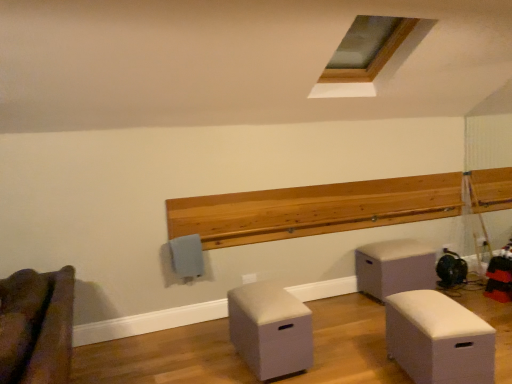
Question: Could clear glass window at upper center be considered to be inside beige fabric ottoman at center, which ranks as the third furniture in right-to-left order?

Choices:
 (A) no
 (B) yes

Answer: (A)

Question: Does beige fabric ottoman at center, which is the 2th furniture from left to right, appear on the right side of clear glass window at upper center?

Choices:
 (A) no
 (B) yes

Answer: (A)

Question: Is beige fabric ottoman at center, which ranks as the third furniture in right-to-left order, located outside clear glass window at upper center?

Choices:
 (A) yes
 (B) no

Answer: (A)

Question: Can you confirm if beige fabric ottoman at center, which is the 2th furniture from left to right, is shorter than clear glass window at upper center?

Choices:
 (A) yes
 (B) no

Answer: (A)

Question: Considering the relative sizes of beige fabric ottoman at center, which ranks as the third furniture in right-to-left order, and clear glass window at upper center in the image provided, is beige fabric ottoman at center, which ranks as the third furniture in right-to-left order, smaller than clear glass window at upper center?

Choices:
 (A) no
 (B) yes

Answer: (B)

Question: Does beige fabric ottoman at center, which ranks as the third furniture in right-to-left order, appear on the left side of clear glass window at upper center?

Choices:
 (A) yes
 (B) no

Answer: (A)

Question: Is wooden ledge at upper center positioned beyond the bounds of beige fabric ottoman at center, which ranks as the third furniture in right-to-left order?

Choices:
 (A) yes
 (B) no

Answer: (A)

Question: Is wooden ledge at upper center at the left side of beige fabric ottoman at center, which ranks as the third furniture in right-to-left order?

Choices:
 (A) yes
 (B) no

Answer: (B)

Question: Is wooden ledge at upper center to the right of beige fabric ottoman at center, which ranks as the third furniture in right-to-left order, from the viewer's perspective?

Choices:
 (A) no
 (B) yes

Answer: (B)

Question: Is wooden ledge at upper center taller than beige fabric ottoman at center, which ranks as the third furniture in right-to-left order?

Choices:
 (A) yes
 (B) no

Answer: (A)

Question: Is the position of wooden ledge at upper center less distant than that of beige fabric ottoman at center, which ranks as the third furniture in right-to-left order?

Choices:
 (A) no
 (B) yes

Answer: (A)

Question: Can you confirm if wooden ledge at upper center is smaller than beige fabric ottoman at center, which ranks as the third furniture in right-to-left order?

Choices:
 (A) no
 (B) yes

Answer: (A)

Question: Considering the relative sizes of matte gray ottoman at center right, the 4th furniture positioned from the left, and clear glass window at upper center in the image provided, is matte gray ottoman at center right, the 4th furniture positioned from the left, bigger than clear glass window at upper center?

Choices:
 (A) yes
 (B) no

Answer: (B)